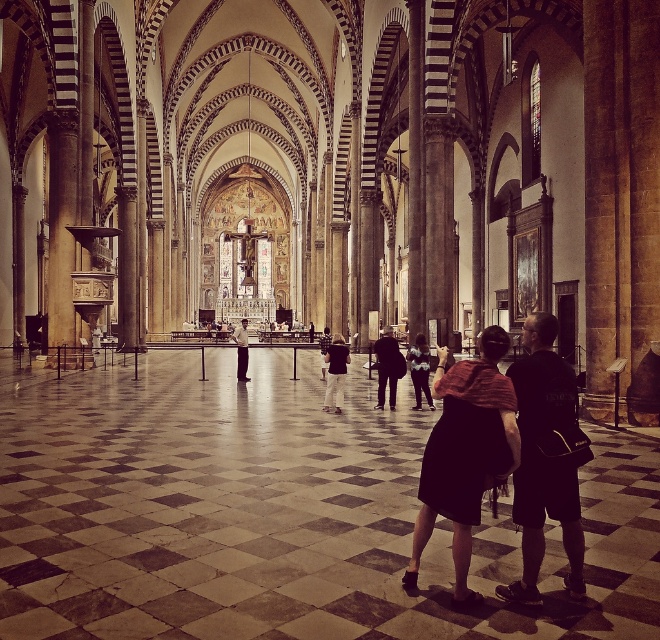
You are a visitor in the cathedral and want to take a photo of both the dark brown fabric dress at center and the matte black suit at center. Since the cathedral has a checkered floor, which object would you need to move closer to the camera to ensure both are fully visible in the frame?

The dark brown fabric dress at center occupies less space than the matte black suit at center, so you would need to move the dark brown fabric dress at center closer to the camera to compensate for its smaller size and ensure both are fully visible in the frame.

You are standing in the cathedral and see a black fabric backpack at lower right and dark gray jeans at center. Which object is positioned more to the right side of the cathedral?

The black fabric backpack at lower right is positioned more to the right side of the cathedral than the dark gray jeans at center.